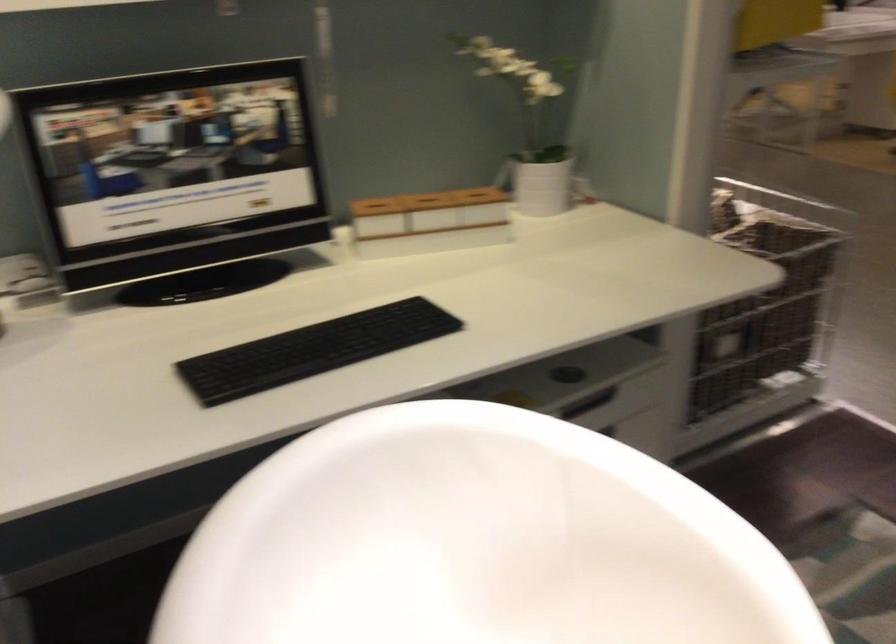
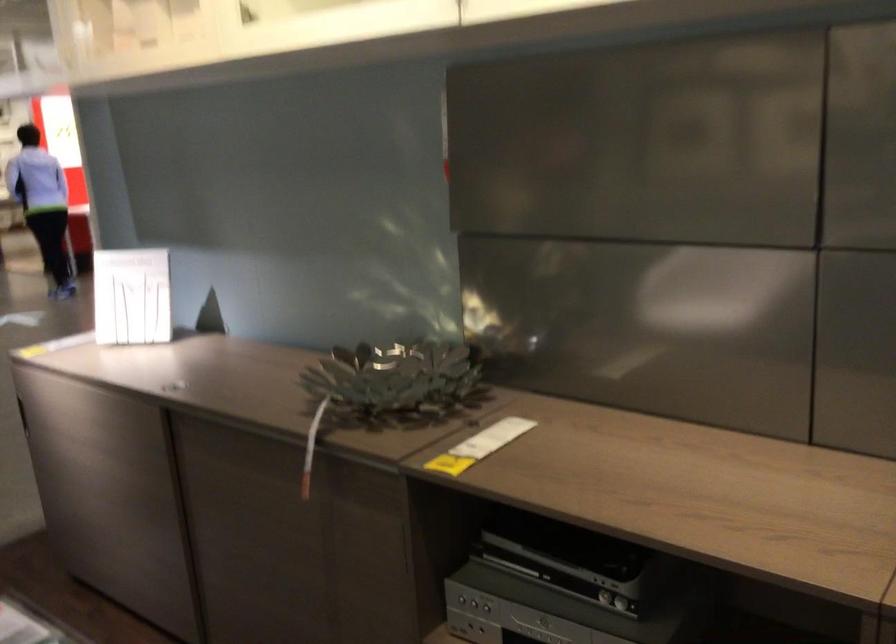
Question: The camera is either moving clockwise (left) or counter-clockwise (right) around the object. The first image is from the beginning of the video and the second image is from the end. Is the camera moving left or right when shooting the video?

Choices:
 (A) Left
 (B) Right

Answer: (A)